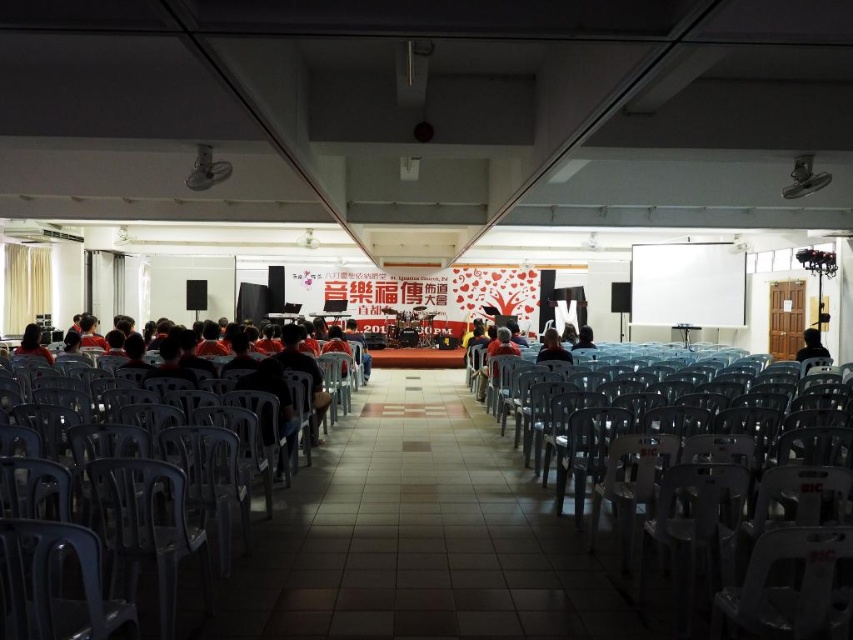
Who is higher up, plastic gray chair at center or orange fabric shirt at center?

plastic gray chair at center is above.

Can you confirm if plastic gray chair at center is positioned below orange fabric shirt at center?

No.

Who is more distant from viewer, (728, 612) or (366, 355)?

Positioned behind is point (366, 355).

This screenshot has height=640, width=853. I want to click on plastic gray chair at center, so click(689, 490).

Does plastic at left have a lesser height compared to black fabric at center?

No.

Measure the distance from plastic at left to black fabric at center.

The distance of plastic at left from black fabric at center is 8.14 meters.

Who is more distant from viewer, (44, 570) or (799, 349)?

Point (799, 349)

Find the location of a particular element. The image size is (853, 640). plastic at left is located at coordinates (148, 513).

Is matte black hair at left taller than black fabric at center?

No.

Can you confirm if matte black hair at left is shorter than black fabric at center?

Yes.

Does point (39, 356) come farther from viewer compared to point (811, 355)?

No, (39, 356) is closer to viewer.

Where is `matte black hair at left`? The image size is (853, 640). matte black hair at left is located at coordinates (32, 342).